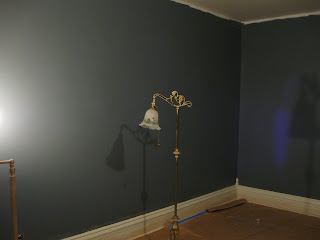
I want to click on wall, so click(x=269, y=149).